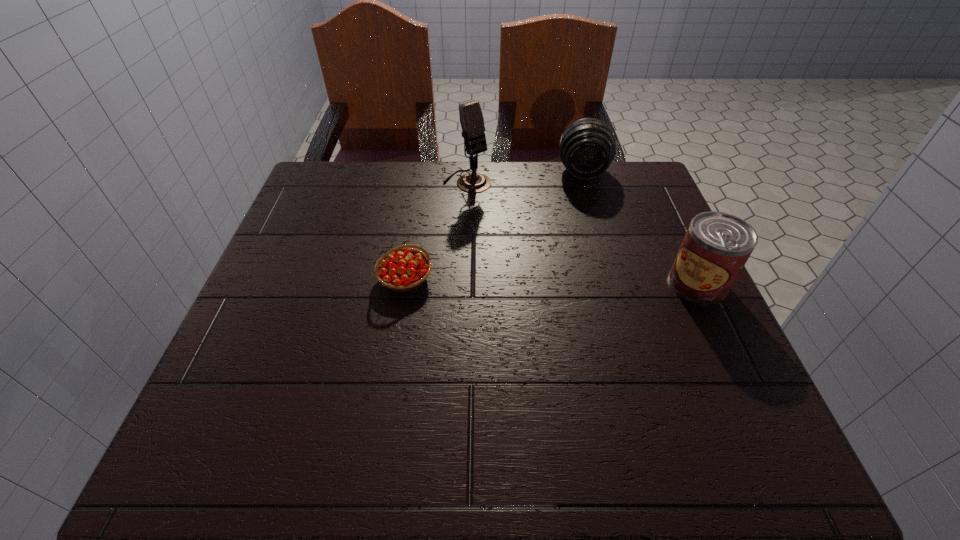
This screenshot has width=960, height=540. Identify the location of unoccupied position between the leftmost object and the second object from left to right. (436, 230).

What are the coordinates of `vacant region between the shortest object and the rightmost object` in the screenshot? It's located at (551, 281).

Locate an element on the screen. The height and width of the screenshot is (540, 960). empty space that is in between the microphone and the rightmost object is located at coordinates (583, 233).

Where is `free space that is in between the rightmost object and the leftmost object`? The width and height of the screenshot is (960, 540). free space that is in between the rightmost object and the leftmost object is located at coordinates (551, 281).

Where is `vacant point located between the leftmost object and the rightmost object`? This screenshot has height=540, width=960. vacant point located between the leftmost object and the rightmost object is located at coordinates (551, 281).

Where is `vacant space in between the second object from right to left and the leftmost object`? The image size is (960, 540). vacant space in between the second object from right to left and the leftmost object is located at coordinates (494, 226).

Find the location of a particular element. This screenshot has width=960, height=540. the closest object to the rightmost object is located at coordinates (587, 147).

Where is `the third closest object to the second object from right to left`? the third closest object to the second object from right to left is located at coordinates (401, 269).

Identify the location of blank area in the image that satisfies the following two spatial constraints: 1. on the back side of the strawberry; 2. on the left side of the telephoto lens. tap(422, 173).